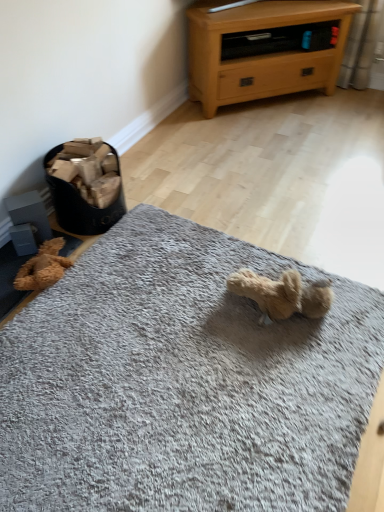
At what (x,y) coordinates should I click in order to perform the action: click on spots to the right of light oak wood chest of drawers at upper right. Please return your answer as a coordinate pair (x, y). Looking at the image, I should click on (340, 108).